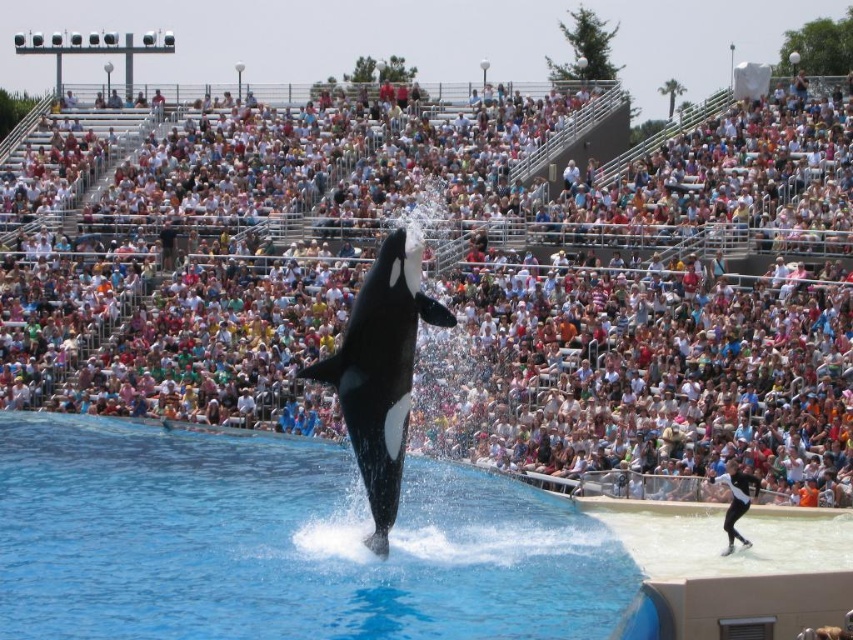
You are standing at the edge of the orca show pool and want to throw a small toy into the clear blue water at center. The toy has a range of 40 meters. Will it reach the water?

The clear blue water at center is 41.24 meters away from the viewer. Since the toy can only reach 40 meters, it will not be able to reach the water.

You are a photographer standing at the edge of the pool. You want to capture a wide shot of the black smooth orca at center and the clear blue water at center. Which object will occupy more space in your photo?

The clear blue water at center will occupy more space in your photo since its width is larger than the black smooth orca at center.